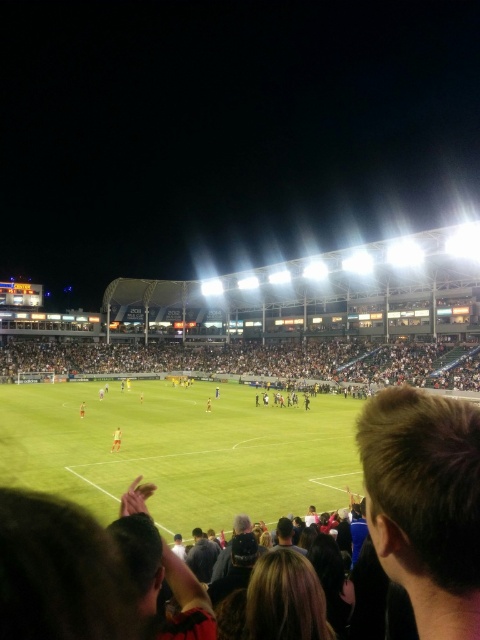
Who is shorter, light brown leather jacket at center or orange fabric person at center?

orange fabric person at center is shorter.

Who is positioned more to the left, light brown leather jacket at center or orange fabric person at center?

orange fabric person at center is more to the left.

Is point (117, 428) closer to viewer compared to point (83, 404)?

Yes, point (117, 428) is in front of point (83, 404).

At what (x,y) coordinates should I click in order to perform the action: click on light brown leather jacket at center. Please return your answer as a coordinate pair (x, y). Looking at the image, I should click on (116, 440).

Does dark gray crowd at center have a greater height compared to yellow jersey at center?

Correct, dark gray crowd at center is much taller as yellow jersey at center.

Which of these two, dark gray crowd at center or yellow jersey at center, stands shorter?

Standing shorter between the two is yellow jersey at center.

Where is `dark gray crowd at center`? dark gray crowd at center is located at coordinates (256, 360).

Does dark gray crowd at center appear under light brown leather jacket at center?

Incorrect, dark gray crowd at center is not positioned below light brown leather jacket at center.

Is dark gray crowd at center smaller than light brown leather jacket at center?

Incorrect, dark gray crowd at center is not smaller in size than light brown leather jacket at center.

Describe the element at coordinates (256, 360) in the screenshot. Image resolution: width=480 pixels, height=640 pixels. I see `dark gray crowd at center` at that location.

You are a GUI agent. You are given a task and a screenshot of the screen. Output one action in this format:
    pyautogui.click(x=<x>, y=<y>)
    Task: Click on the dark gray crowd at center
    
    Given the screenshot: What is the action you would take?
    pyautogui.click(x=256, y=360)